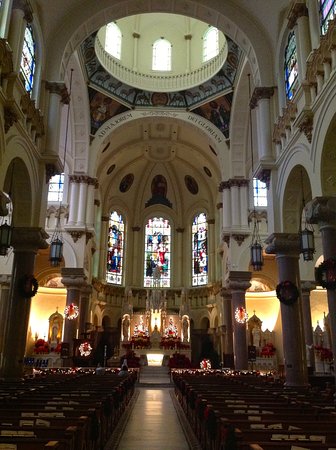
In order to click on statue in this screenshot , I will do `click(125, 329)`, `click(55, 335)`, `click(142, 330)`, `click(155, 328)`, `click(171, 329)`, `click(186, 331)`, `click(257, 336)`, `click(321, 341)`.